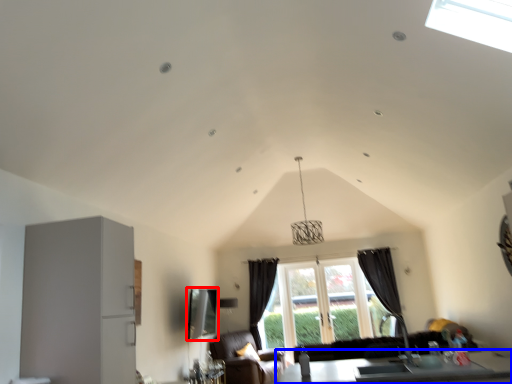
Question: Among these objects, which one is farthest to the camera, window screen (highlighted by a red box) or table (highlighted by a blue box)?

Choices:
 (A) window screen
 (B) table

Answer: (A)